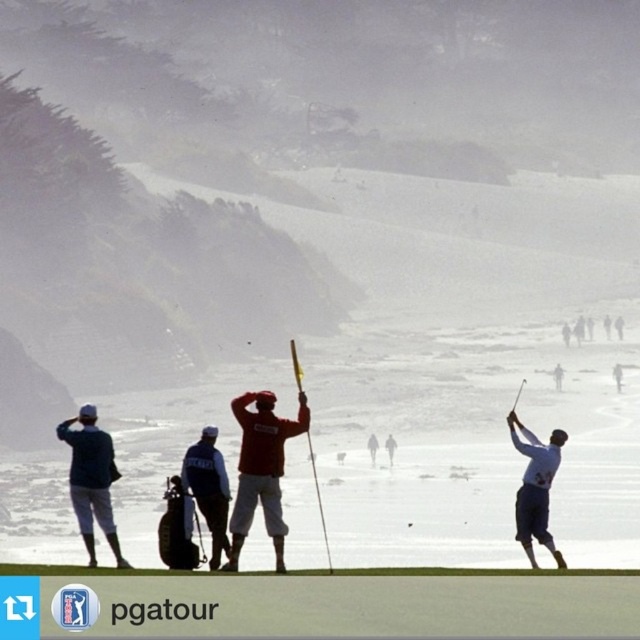
You are a golfer standing at the starting point of the course and see the green turf at center and the denim pants at left. Which object is farther from your current position?

The denim pants at left are farther away from your current position because they are 6.62 meters away from the green turf at center, which is closer to you.

You are standing at the point with coordinates point [544,465] and want to walk to the point with coordinates point [196,456]. Which direction should you move in to get closer to your destination?

You should move away from the viewer since point [544,465] is further to the viewer than point [196,456].